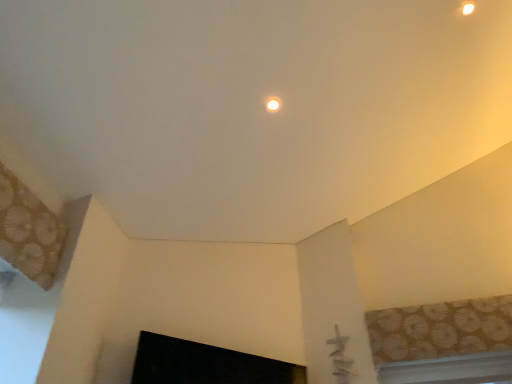
Question: Would you say matte white light fixture at upper center contains black glossy fireplace at lower center?

Choices:
 (A) no
 (B) yes

Answer: (A)

Question: Is matte white light fixture at upper center bigger than black glossy fireplace at lower center?

Choices:
 (A) yes
 (B) no

Answer: (B)

Question: Is matte white light fixture at upper center in front of black glossy fireplace at lower center?

Choices:
 (A) no
 (B) yes

Answer: (A)

Question: Does matte white light fixture at upper center turn towards black glossy fireplace at lower center?

Choices:
 (A) yes
 (B) no

Answer: (B)

Question: Is there a large distance between matte white light fixture at upper center and black glossy fireplace at lower center?

Choices:
 (A) no
 (B) yes

Answer: (B)

Question: Is point (421, 362) closer or farther from the camera than point (267, 104)?

Choices:
 (A) farther
 (B) closer

Answer: (A)

Question: Considering the relative positions of patterned fabric window at upper right, which is counted as the second window, starting from the bottom, and matte white light fixture at upper center in the image provided, is patterned fabric window at upper right, which is counted as the second window, starting from the bottom, to the left or to the right of matte white light fixture at upper center?

Choices:
 (A) left
 (B) right

Answer: (B)

Question: Looking at their shapes, would you say patterned fabric window at upper right, placed as the 1th window when sorted from top to bottom, is wider or thinner than matte white light fixture at upper center?

Choices:
 (A) thin
 (B) wide

Answer: (B)

Question: Looking at the image, does patterned fabric window at upper right, placed as the 1th window when sorted from top to bottom, seem bigger or smaller compared to matte white light fixture at upper center?

Choices:
 (A) small
 (B) big

Answer: (B)

Question: In terms of width, does patterned fabric window at upper right, placed as the 1th window when sorted from top to bottom, look wider or thinner when compared to black glossy fireplace at lower center?

Choices:
 (A) thin
 (B) wide

Answer: (A)

Question: Is patterned fabric window at upper right, placed as the 1th window when sorted from top to bottom, taller or shorter than black glossy fireplace at lower center?

Choices:
 (A) tall
 (B) short

Answer: (A)

Question: Do you think patterned fabric window at upper right, which is counted as the second window, starting from the bottom, is within black glossy fireplace at lower center, or outside of it?

Choices:
 (A) inside
 (B) outside

Answer: (B)

Question: Considering the positions of point (495, 375) and point (245, 360), is point (495, 375) closer or farther from the camera than point (245, 360)?

Choices:
 (A) closer
 (B) farther

Answer: (B)

Question: Considering the positions of matte white light fixture at upper center and white plastic window at lower right, marked as the second window in a top-to-bottom arrangement, in the image, is matte white light fixture at upper center wider or thinner than white plastic window at lower right, marked as the second window in a top-to-bottom arrangement,?

Choices:
 (A) wide
 (B) thin

Answer: (B)

Question: Do you think matte white light fixture at upper center is within white plastic window at lower right, marked as the second window in a top-to-bottom arrangement, or outside of it?

Choices:
 (A) inside
 (B) outside

Answer: (B)